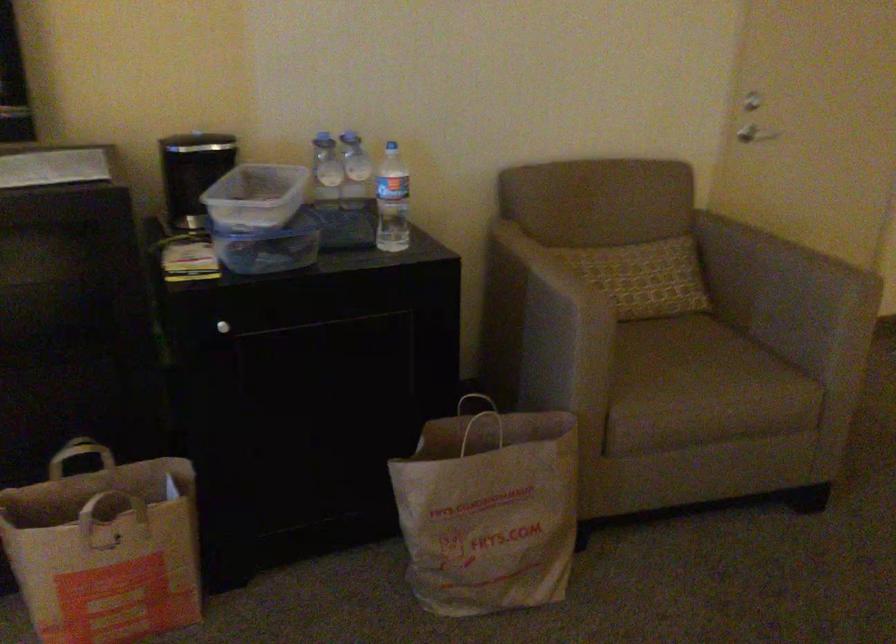
Where is `silver cabinet knob`? silver cabinet knob is located at coordinates (222, 327).